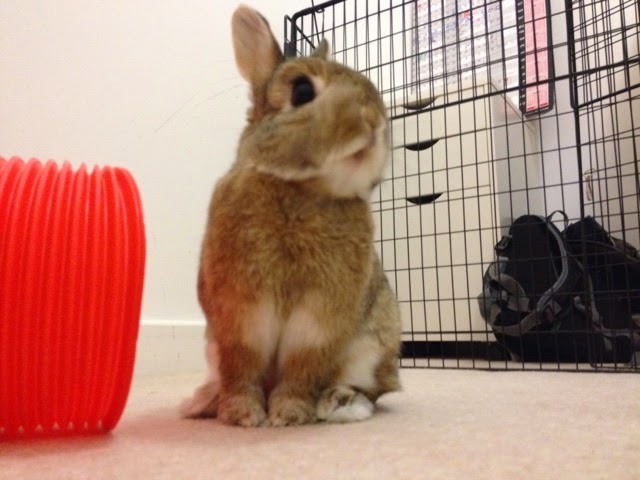
I want to click on calendar, so click(x=454, y=30).